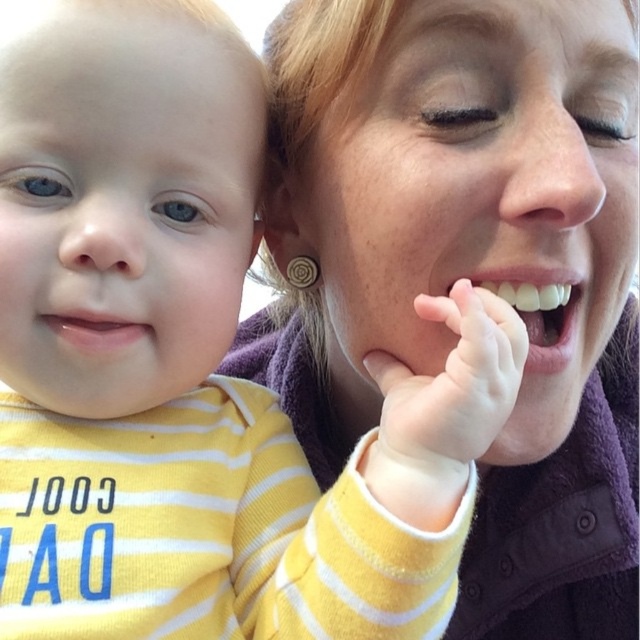
Between matte purple jacket at center and soft pink skin at mouth right, which one is positioned higher?

matte purple jacket at center is higher up.

Measure the distance between matte purple jacket at center and camera.

matte purple jacket at center and camera are 15.41 inches apart.

Is point (385, 234) positioned behind point (480, 406)?

Yes, it is behind point (480, 406).

Locate an element on the screen. This screenshot has width=640, height=640. matte purple jacket at center is located at coordinates (468, 268).

Between soft pink skin at mouth right and white glossy teeth at center, which one appears on the right side from the viewer's perspective?

Positioned to the right is white glossy teeth at center.

Who is more distant from viewer, (x=493, y=358) or (x=573, y=308)?

→ Point (x=573, y=308)

The width and height of the screenshot is (640, 640). In order to click on soft pink skin at mouth right in this screenshot , I will do `click(454, 378)`.

Which is in front, point (493, 349) or point (52, 320)?

Positioned in front is point (493, 349).

Is soft pink skin at mouth right smaller than matte yellow lip at lower left?

No, soft pink skin at mouth right is not smaller than matte yellow lip at lower left.

The height and width of the screenshot is (640, 640). In order to click on soft pink skin at mouth right in this screenshot , I will do `click(454, 378)`.